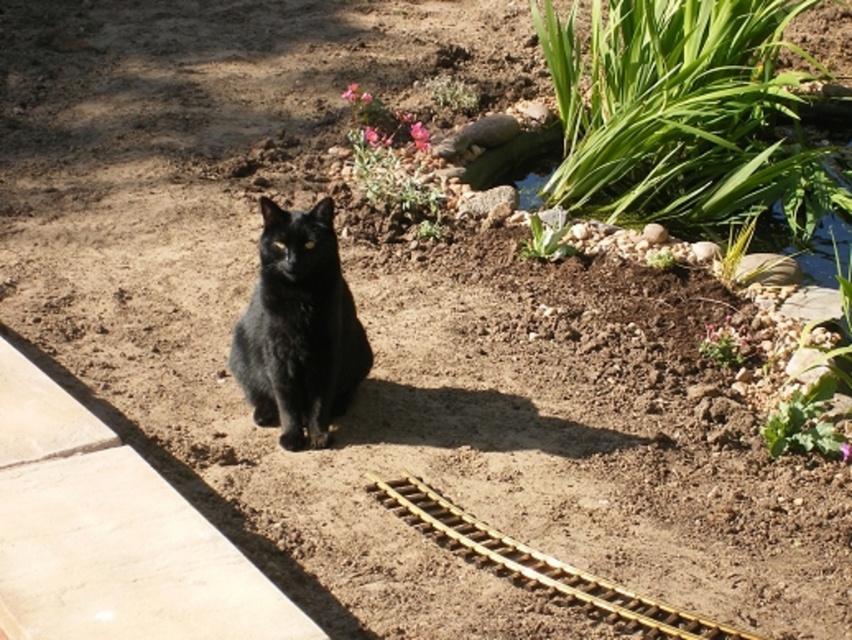
You are standing at the point marked by the coordinates (x=298, y=330) in the garden. Looking around, you see the black fur cat at center and the pink flowers to the right. Which direction should you walk to reach the pink flowers?

The pink flowers are to the right of the black fur cat at center, so you should walk to the right from the point marked by the coordinates (x=298, y=330) to reach them.

You are a photographer trying to capture both the black fur cat at center and the gold metallic train track at center in a single frame. Based on their sizes, which one should you focus on first to ensure both are clearly visible?

The black fur cat at center is smaller than the gold metallic train track at center, so you should focus on the gold metallic train track at center first to ensure both are clearly visible.

Consider the image. You are a gardener who wants to place a new gold metallic train track at center without disturbing the black fur cat at center. What should you do?

The black fur cat at center is positioned over the gold metallic train track at center. To avoid disturbing the cat, you should wait until the cat moves away from the area before placing the new train track.